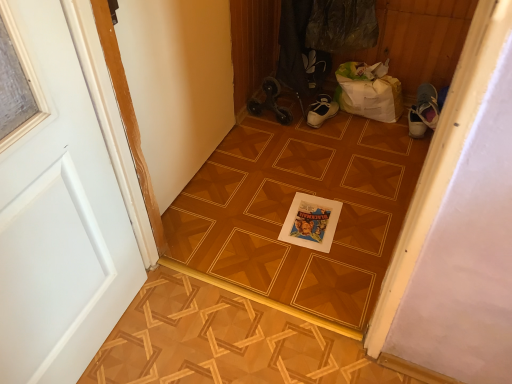
Question: Does wooden parquet floor at center have a lesser width compared to white painted wood door at left?

Choices:
 (A) yes
 (B) no

Answer: (B)

Question: Would you consider wooden parquet floor at center to be distant from white painted wood door at left?

Choices:
 (A) yes
 (B) no

Answer: (B)

Question: Can you confirm if wooden parquet floor at center is bigger than white painted wood door at left?

Choices:
 (A) no
 (B) yes

Answer: (A)

Question: Considering the relative sizes of wooden parquet floor at center and white painted wood door at left in the image provided, is wooden parquet floor at center smaller than white painted wood door at left?

Choices:
 (A) yes
 (B) no

Answer: (A)

Question: Does wooden parquet floor at center come behind white painted wood door at left?

Choices:
 (A) no
 (B) yes

Answer: (B)

Question: From the image's perspective, is wooden parquet floor at center above or below wooden parquet floor at center?

Choices:
 (A) below
 (B) above

Answer: (A)

Question: Considering the positions of wooden parquet floor at center and wooden parquet floor at center in the image, is wooden parquet floor at center wider or thinner than wooden parquet floor at center?

Choices:
 (A) thin
 (B) wide

Answer: (A)

Question: From a real-world perspective, is wooden parquet floor at center physically located above or below wooden parquet floor at center?

Choices:
 (A) below
 (B) above

Answer: (A)

Question: Is wooden parquet floor at center inside or outside of wooden parquet floor at center?

Choices:
 (A) inside
 (B) outside

Answer: (B)

Question: Is white painted wood door at left to the left or to the right of wooden parquet floor at center in the image?

Choices:
 (A) right
 (B) left

Answer: (B)

Question: Is white painted wood door at left bigger or smaller than wooden parquet floor at center?

Choices:
 (A) small
 (B) big

Answer: (B)

Question: Is white painted wood door at left spatially inside wooden parquet floor at center, or outside of it?

Choices:
 (A) outside
 (B) inside

Answer: (A)

Question: From the image's perspective, is white painted wood door at left above or below wooden parquet floor at center?

Choices:
 (A) below
 (B) above

Answer: (B)

Question: In the image, is white painted wood door at left positioned in front of or behind wooden parquet floor at center?

Choices:
 (A) front
 (B) behind

Answer: (A)

Question: Considering the relative positions of white painted wood door at left and wooden parquet floor at center in the image provided, is white painted wood door at left to the left or to the right of wooden parquet floor at center?

Choices:
 (A) right
 (B) left

Answer: (B)